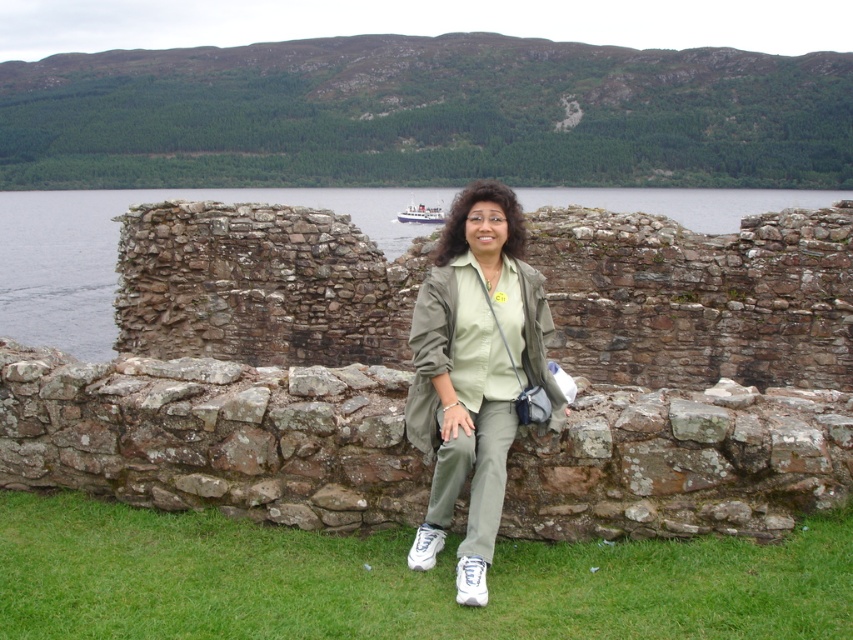
In the scene shown: You are a photographer trying to capture the scenic landscape in the image. You notice two points marked in the scene. The first point is at coordinate point (318, 582), and the second is at point (303, 202). Which of these points is closer to you?

Point (318, 582) is closer to the viewer than point (303, 202) according to the description.

Consider the image. You are a photographer wanting to capture the olive green fabric at center and clear water at center in the same frame. Based on the scene, which object should you focus on first to ensure both are in the frame?

The olive green fabric at center has a smaller size compared to clear water at center, so you should focus on the olive green fabric at center first to ensure both are in the frame.

Consider the image. You are a photographer trying to capture the clear water at center and the brushed metal boat at upper center in a single shot. Which object should you position closer to the left side of your camera frame?

The brushed metal boat at upper center should be positioned closer to the left side of your camera frame because the clear water at center is on its right side according to the description.